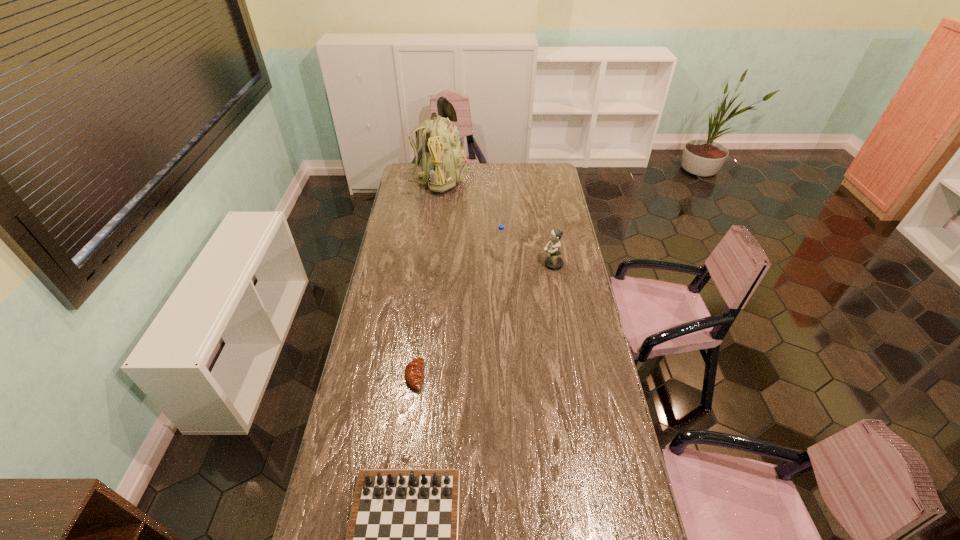
This screenshot has height=540, width=960. I want to click on vacant region between the backpack and the figurine, so click(x=493, y=222).

Image resolution: width=960 pixels, height=540 pixels. Identify the location of free space between the rightmost object and the backpack. (493, 222).

You are a GUI agent. You are given a task and a screenshot of the screen. Output one action in this format:
    pyautogui.click(x=<x>, y=<y>)
    Task: Click on the unoccupied area between the figurine and the second object from right to left
    
    Given the screenshot: What is the action you would take?
    pyautogui.click(x=526, y=261)

You are a GUI agent. You are given a task and a screenshot of the screen. Output one action in this format:
    pyautogui.click(x=<x>, y=<y>)
    Task: Click on the free space between the water bottle and the rightmost object
    The image size is (960, 540).
    Given the screenshot: What is the action you would take?
    pyautogui.click(x=526, y=261)

The image size is (960, 540). Identify the location of blank region between the figurine and the fourth farthest object. (484, 320).

You are a GUI agent. You are given a task and a screenshot of the screen. Output one action in this format:
    pyautogui.click(x=<x>, y=<y>)
    Task: Click on the object that stands as the third closest to the tallest object
    The width and height of the screenshot is (960, 540).
    Given the screenshot: What is the action you would take?
    pyautogui.click(x=413, y=374)

Identify which object is the closest to the nearest object. Please provide its 2D coordinates. Your answer should be formatted as a tuple, i.e. [(x, y)], where the tuple contains the x and y coordinates of a point satisfying the conditions above.

[(413, 374)]

At what (x,y) coordinates should I click in order to perform the action: click on vacant space that satisfies the following two spatial constraints: 1. on the front-facing side of the tallest object; 2. on the back side of the fourth farthest object. Please return your answer as a coordinate pair (x, y). This screenshot has height=540, width=960. Looking at the image, I should click on (406, 376).